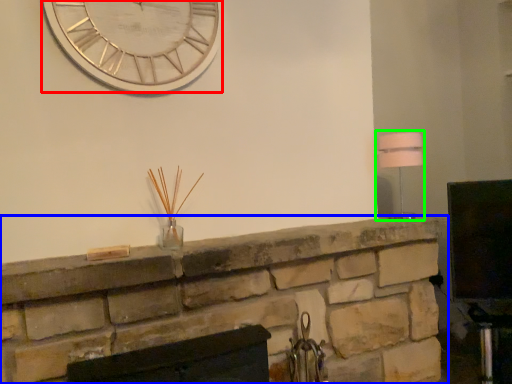
Question: Which is farther away from wall clock (highlighted by a red box)? fireplace (highlighted by a blue box) or lamp (highlighted by a green box)?

Choices:
 (A) fireplace
 (B) lamp

Answer: (B)